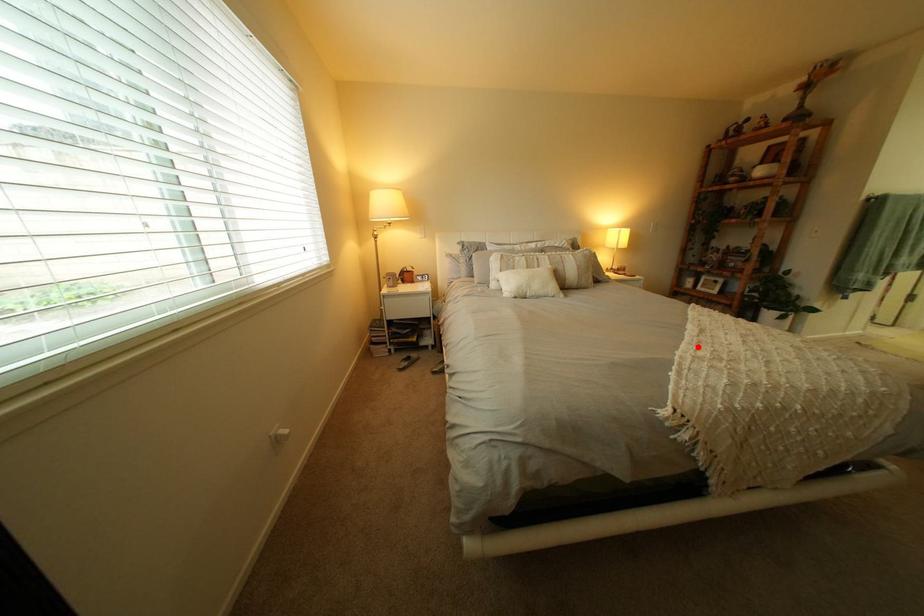
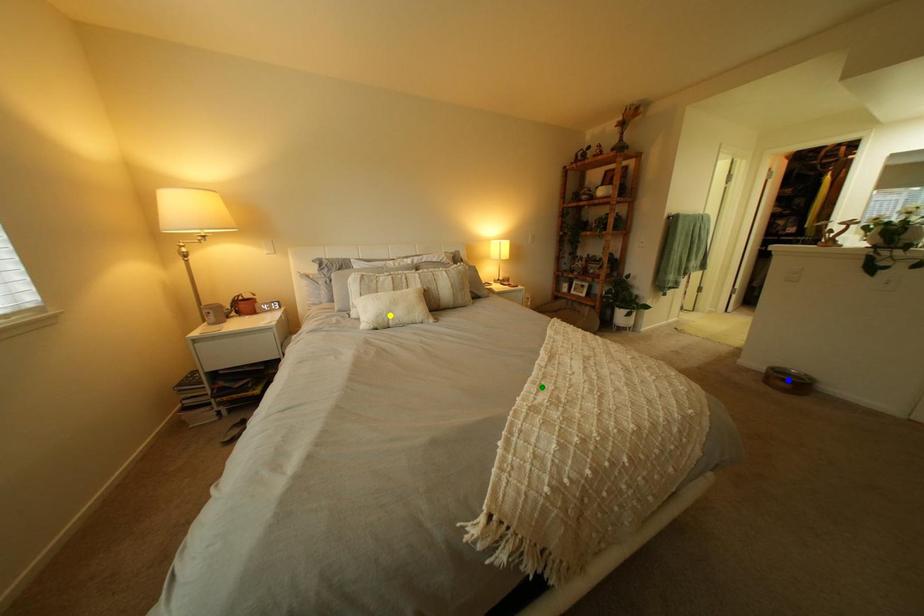
Question: I am providing you with two images of the same scene from different viewpoints. A red point is marked on the first image. You are given multiple points on the second image. Can you choose the point in image 2 that corresponds to the point in image 1?

Choices:
 (A) green point
 (B) yellow point
 (C) blue point

Answer: (A)